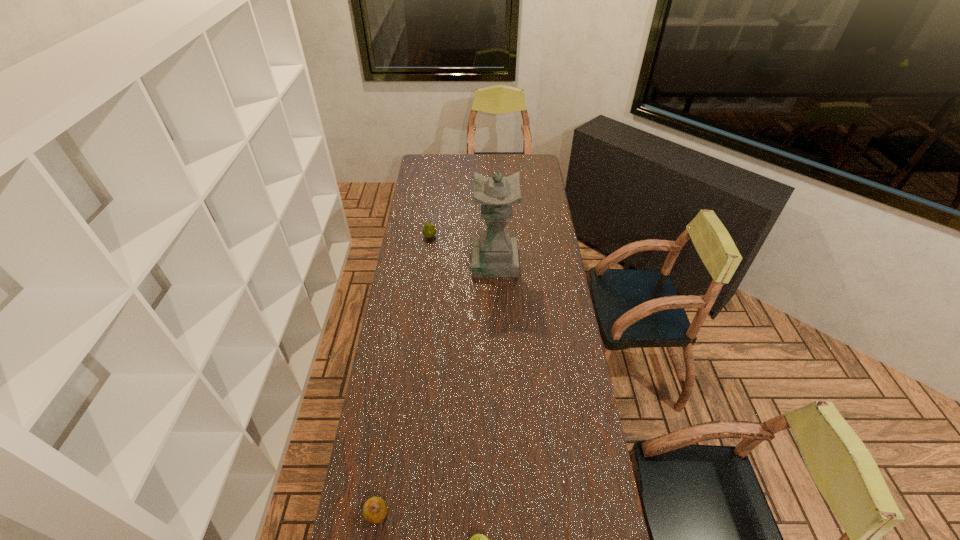
This screenshot has width=960, height=540. Find the location of `the tallest object`. the tallest object is located at coordinates (494, 253).

Where is `the third nearest object`? This screenshot has height=540, width=960. the third nearest object is located at coordinates (494, 253).

The height and width of the screenshot is (540, 960). What are the coordinates of `the farthest object` in the screenshot? It's located at (429, 230).

Locate an element on the screen. The height and width of the screenshot is (540, 960). the second nearest object is located at coordinates (375, 509).

The width and height of the screenshot is (960, 540). I want to click on blank area located at the front opening of the tallest object, so click(425, 261).

Identify the location of free space located 0.070m at the front opening of the tallest object. (457, 261).

Image resolution: width=960 pixels, height=540 pixels. Find the location of `free space located at the front opening of the tallest object`. free space located at the front opening of the tallest object is located at coordinates (419, 261).

Identify the location of vacant space located 0.270m on the back of the farthest pear. Image resolution: width=960 pixels, height=540 pixels. (434, 200).

Identify the location of free space located on the back of the second farthest pear. (391, 420).

At what (x,y) coordinates should I click in order to perform the action: click on vacant space at the far edge. Please return your answer as a coordinate pair (x, y). This screenshot has width=960, height=540. Looking at the image, I should click on (481, 157).